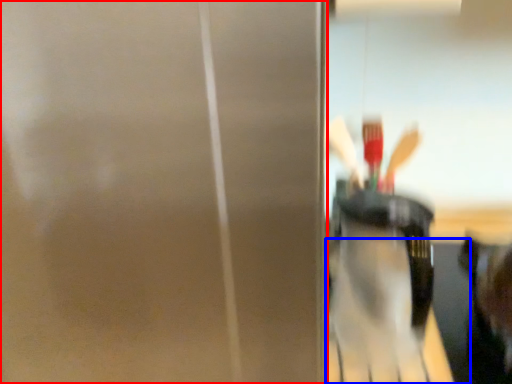
Question: Which point is further to the camera, screen door (highlighted by a red box) or table (highlighted by a blue box)?

Choices:
 (A) screen door
 (B) table

Answer: (B)